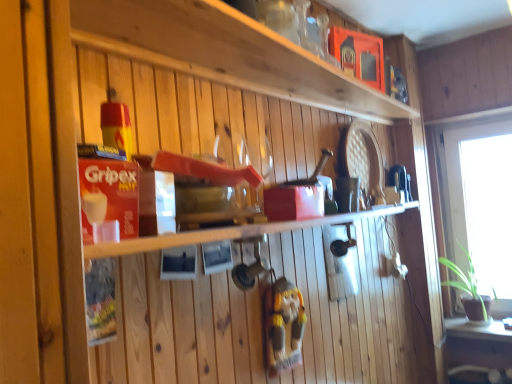
Question: Considering the relative sizes of green matte table at lower right and matte wooden shelf at upper center, which is the second shelf in bottom-to-top order, in the image provided, is green matte table at lower right smaller than matte wooden shelf at upper center, which is the second shelf in bottom-to-top order,?

Choices:
 (A) no
 (B) yes

Answer: (A)

Question: From the image's perspective, is green matte table at lower right on top of matte wooden shelf at upper center, acting as the 1th shelf starting from the top?

Choices:
 (A) no
 (B) yes

Answer: (A)

Question: Is green matte table at lower right closer to camera compared to matte wooden shelf at upper center, acting as the 1th shelf starting from the top?

Choices:
 (A) no
 (B) yes

Answer: (A)

Question: Does green matte table at lower right appear on the left side of matte wooden shelf at upper center, acting as the 1th shelf starting from the top?

Choices:
 (A) yes
 (B) no

Answer: (B)

Question: Does green matte table at lower right have a greater height compared to matte wooden shelf at upper center, acting as the 1th shelf starting from the top?

Choices:
 (A) yes
 (B) no

Answer: (A)

Question: Is green matte table at lower right not near matte wooden shelf at upper center, which is the second shelf in bottom-to-top order?

Choices:
 (A) yes
 (B) no

Answer: (A)

Question: Can you confirm if wooden gnome at center is thinner than green matte table at lower right?

Choices:
 (A) yes
 (B) no

Answer: (A)

Question: Does wooden gnome at center have a smaller size compared to green matte table at lower right?

Choices:
 (A) yes
 (B) no

Answer: (A)

Question: Is wooden gnome at center oriented towards green matte table at lower right?

Choices:
 (A) yes
 (B) no

Answer: (B)

Question: Is wooden gnome at center shorter than green matte table at lower right?

Choices:
 (A) no
 (B) yes

Answer: (A)

Question: Is wooden gnome at center positioned before green matte table at lower right?

Choices:
 (A) yes
 (B) no

Answer: (A)

Question: Is wooden gnome at center at the left side of green matte table at lower right?

Choices:
 (A) no
 (B) yes

Answer: (B)

Question: From the image's perspective, is green matte table at lower right beneath wooden gnome at center?

Choices:
 (A) no
 (B) yes

Answer: (B)